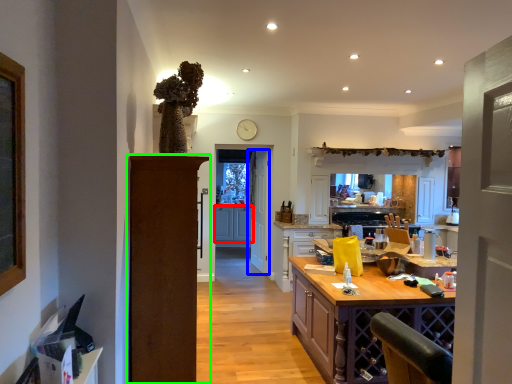
Question: Estimate the real-world distances between objects in this image. Which object is farther from cabinetry (highlighted by a red box), door (highlighted by a blue box) or door (highlighted by a green box)?

Choices:
 (A) door
 (B) door

Answer: (B)